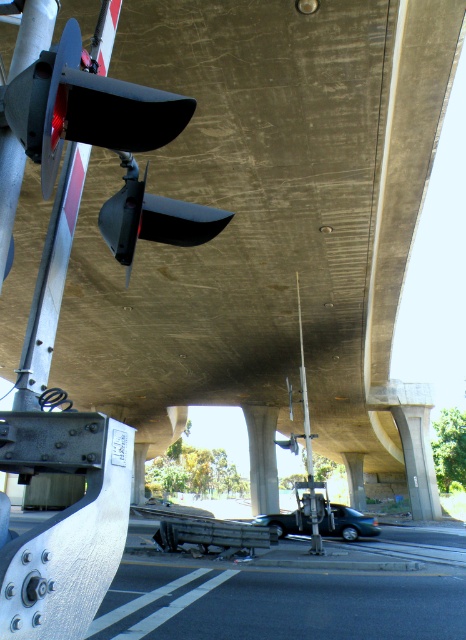
Question: Can you confirm if matte black traffic light at center is bigger than metallic silver pole at center?

Choices:
 (A) no
 (B) yes

Answer: (A)

Question: Does brushed metal highway at lower center have a larger size compared to metallic silver pole at center?

Choices:
 (A) no
 (B) yes

Answer: (B)

Question: Can you confirm if concrete at center is wider than metallic silver pole at center?

Choices:
 (A) no
 (B) yes

Answer: (A)

Question: Estimate the real-world distances between objects in this image. Which object is farther from the brushed metal highway at lower center?

Choices:
 (A) metallic silver pole at center
 (B) concrete at center
 (C) matte black traffic light at center

Answer: (B)

Question: Which object is positioned farthest from the brushed metal highway at lower center?

Choices:
 (A) matte black traffic light at center
 (B) concrete at center

Answer: (B)

Question: Which point is closer to the camera?

Choices:
 (A) concrete at center
 (B) brushed metal highway at lower center
 (C) metallic silver pole at center
 (D) matte black traffic light at center

Answer: (D)